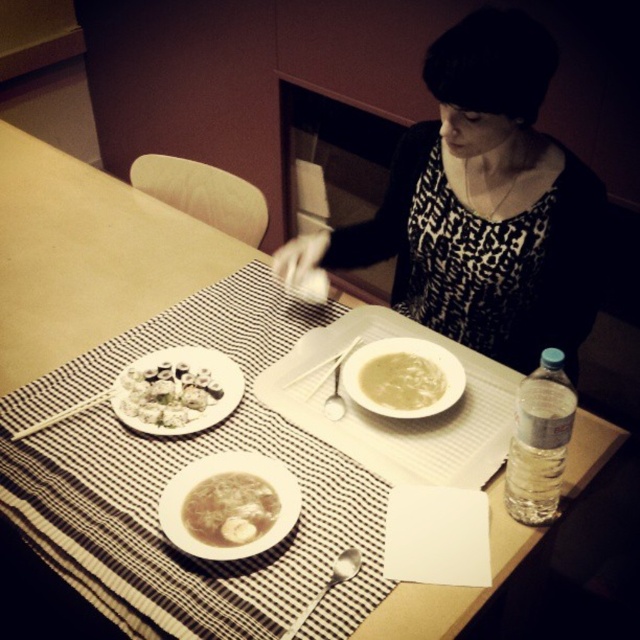
Question: Does white creamy soup at center appear over satin silver spoon at lower center?

Choices:
 (A) no
 (B) yes

Answer: (B)

Question: Estimate the real-world distances between objects in this image. Which object is closer to the translucent soup bowl at center?

Choices:
 (A) white plastic chopsticks at upper left
 (B) white creamy soup at center
 (C) white matte plate at center
 (D) white plastic chopsticks at center

Answer: (C)

Question: Is black leopard print dress at upper center bigger than transparent plastic water bottle at lower right?

Choices:
 (A) no
 (B) yes

Answer: (B)

Question: Can you confirm if black leopard print dress at upper center is bigger than white plastic chopsticks at center?

Choices:
 (A) yes
 (B) no

Answer: (A)

Question: Among these points, which one is farthest from the camera?

Choices:
 (A) (444, 372)
 (B) (509, 467)
 (C) (412, 372)
 (D) (198, 460)

Answer: (C)

Question: Which object appears closest to the camera in this image?

Choices:
 (A) translucent soup bowl at center
 (B) white matte dumplings at center
 (C) white creamy soup at center
 (D) white plastic chopsticks at upper left

Answer: (A)